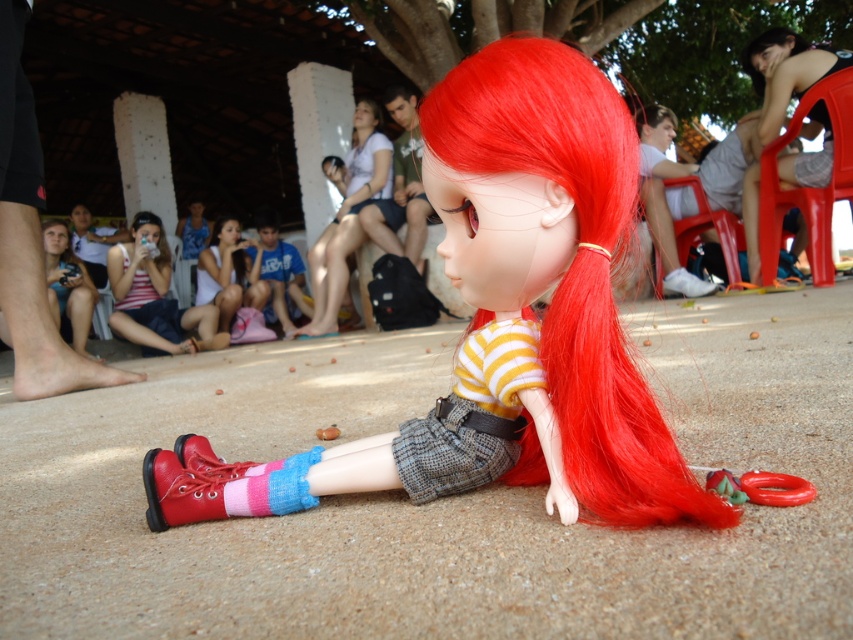
What do you see at coordinates (206, 458) in the screenshot? I see `shiny red leather shoe at lower center` at bounding box center [206, 458].

Between point (223, 474) and point (676, 291), which one is positioned in front?

Point (223, 474)

Locate an element on the screen. shiny red leather shoe at lower center is located at coordinates coord(206,458).

Can you confirm if matte plastic doll at center is wider than rubberized plastic ring at lower center?

Indeed, matte plastic doll at center has a greater width compared to rubberized plastic ring at lower center.

Between matte plastic doll at center and rubberized plastic ring at lower center, which one has less height?

rubberized plastic ring at lower center is shorter.

Who is more distant from viewer, (624, 451) or (793, 496)?

Positioned behind is point (624, 451).

Identify the location of matte plastic doll at center. This screenshot has width=853, height=640. point(532,301).

Does point (207, 257) lie in front of point (666, 288)?

No, it is behind (666, 288).

The image size is (853, 640). Identify the location of matte white shirt at center. coord(228,273).